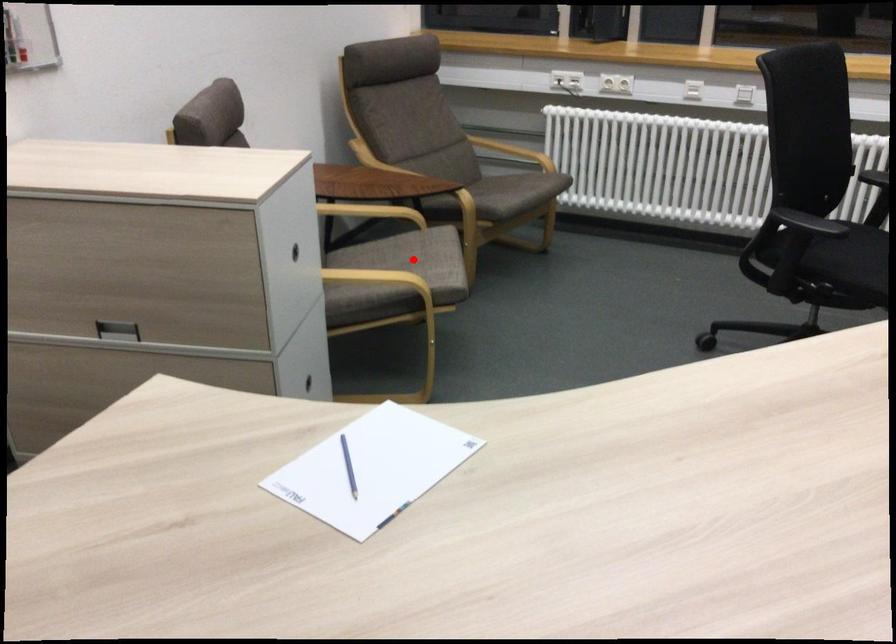
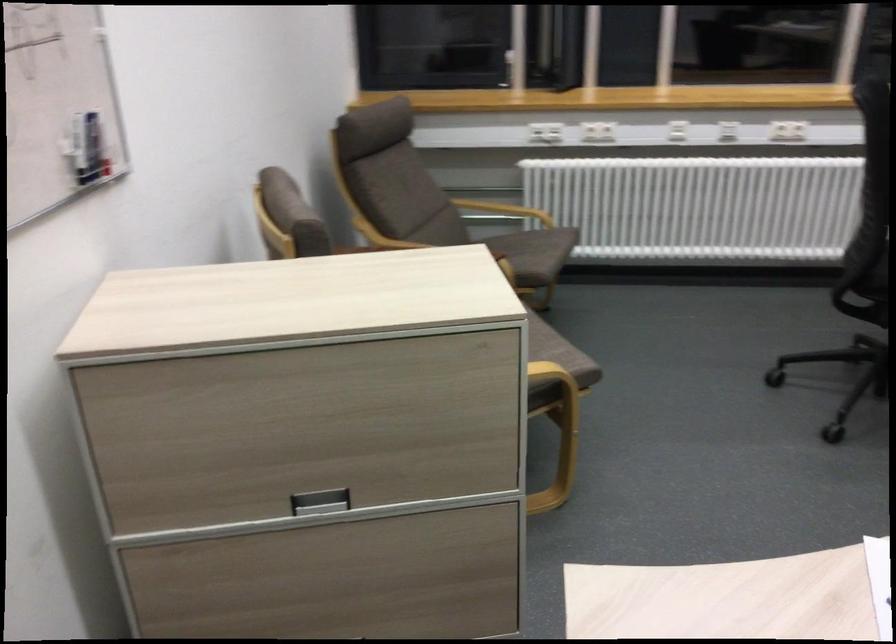
Question: I am providing you with two images of the same scene from different viewpoints. A red point is marked on the first image. At the location where the point appears in image 1, is it still visible in image 2?

Choices:
 (A) Yes
 (B) No

Answer: (B)